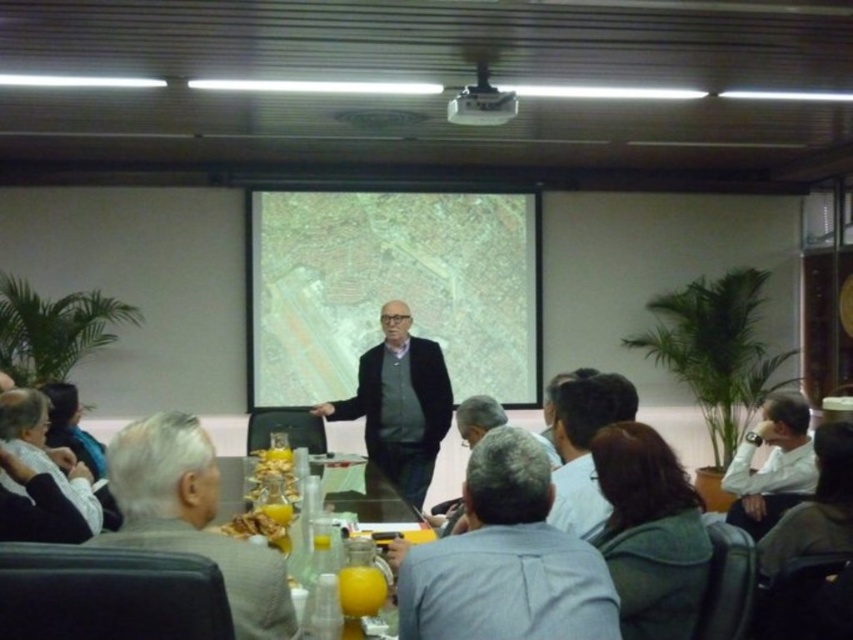
Can you confirm if matte black jacket at center is shorter than translucent glass table at center?

No, matte black jacket at center is not shorter than translucent glass table at center.

Who is positioned more to the right, matte black jacket at center or translucent glass table at center?

Positioned to the right is translucent glass table at center.

I want to click on matte black jacket at center, so click(399, 403).

Looking at this image, is gray suit at center below white shirt at lower right?

No, gray suit at center is not below white shirt at lower right.

Is gray suit at center bigger than white shirt at lower right?

No, gray suit at center is not bigger than white shirt at lower right.

Who is more forward, (554, 630) or (755, 506)?

Positioned in front is point (554, 630).

Image resolution: width=853 pixels, height=640 pixels. Find the location of `gray suit at center`. gray suit at center is located at coordinates (506, 560).

Is matte white map at center taller than matte black jacket at center?

Yes, matte white map at center is taller than matte black jacket at center.

Is matte white map at center below matte black jacket at center?

Actually, matte white map at center is above matte black jacket at center.

Measure the distance between matte white map at center and camera.

matte white map at center and camera are 5.94 meters apart from each other.

Where is `matte white map at center`? matte white map at center is located at coordinates (392, 289).